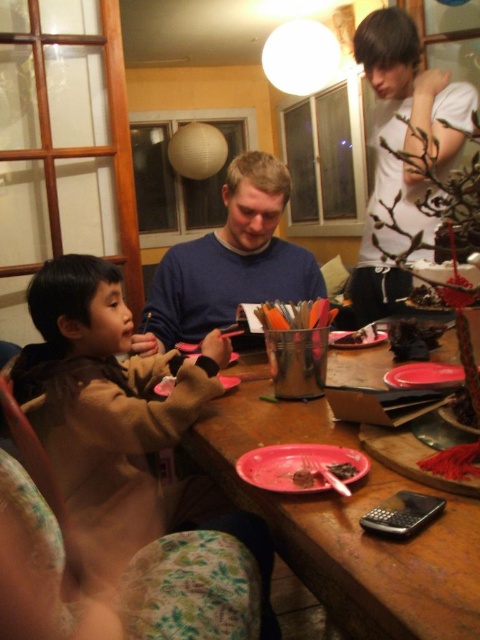
You are a parent trying to decide whether to place a small toy on the table between the blue sweater at center and the matte plastic plate at lower center. Based on their heights, will the toy be visible from above the table?

The blue sweater at center is much taller than the matte plastic plate at lower center. Since the sweater is taller, it might block the view of the toy from above the table, depending on its placement between them.

You are standing in the room and want to place a 50 cm wide painting on the wooden table at center. Can you fit it on the table?

The wooden table at center and viewer are 50.36 centimeters apart from each other. Since the painting is 50 cm wide, it will fit on the table as the distance between you and the table is slightly more than the painting width.

You are a delivery person who needs to place a small package on the wooden table at center without touching the brown fuzzy jacket at left. Can you do this?

The wooden table at center is 8.66 inches away from the brown fuzzy jacket at left, so yes, you can place the package on the table without touching the jacket as there is enough space between them.